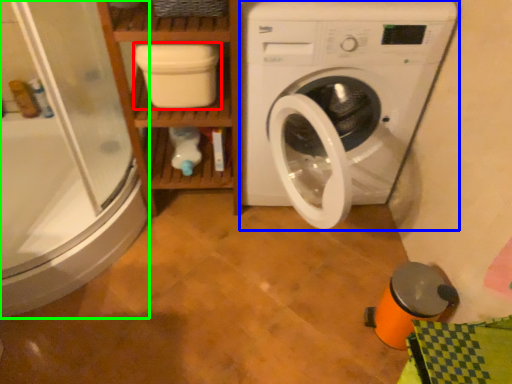
Question: Which object is positioned farthest from dish washer (highlighted by a red box)? Select from washing machine (highlighted by a blue box) and shower door (highlighted by a green box).

Choices:
 (A) washing machine
 (B) shower door

Answer: (B)